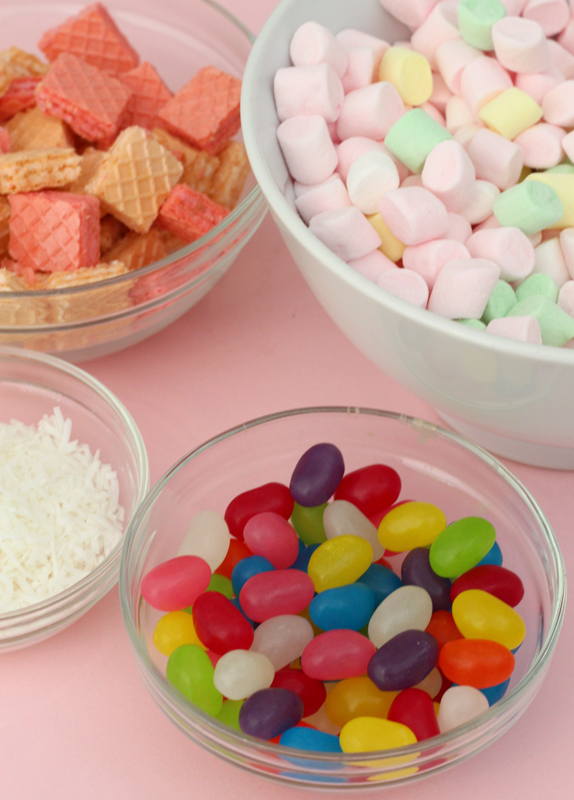
Identify the location of bowl. (201, 500), (137, 442), (124, 334), (477, 346).